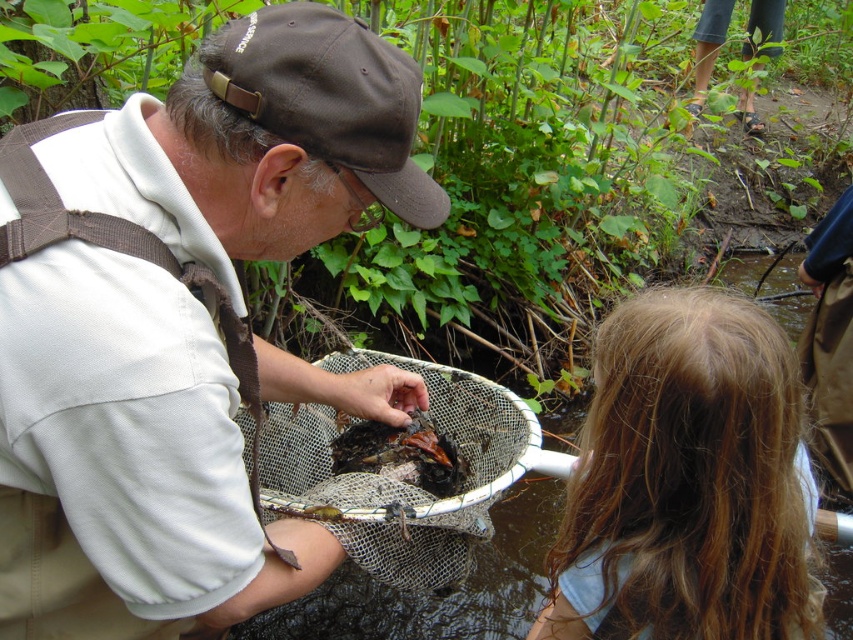
You are a photographer trying to capture both the blonde hair at upper right and the shiny brown crab at center in a single frame. Given their sizes, which one should you focus on to ensure both are clearly visible in the photo?

Since the blonde hair at upper right is larger in size compared to the shiny brown crab at center, you should focus on the shiny brown crab at center to ensure both are clearly visible in the photo.

You are a photographer trying to capture a clear shot of the brown fabric cap at upper center. The camera you are using has a zoom lens that can focus precisely on coordinates. What are the exact coordinates where you should aim your camera to ensure the cap is in the center of the photo?

The brown fabric cap at upper center is located at point (328, 97), so you should aim your camera at those coordinates to center the cap in the photo.